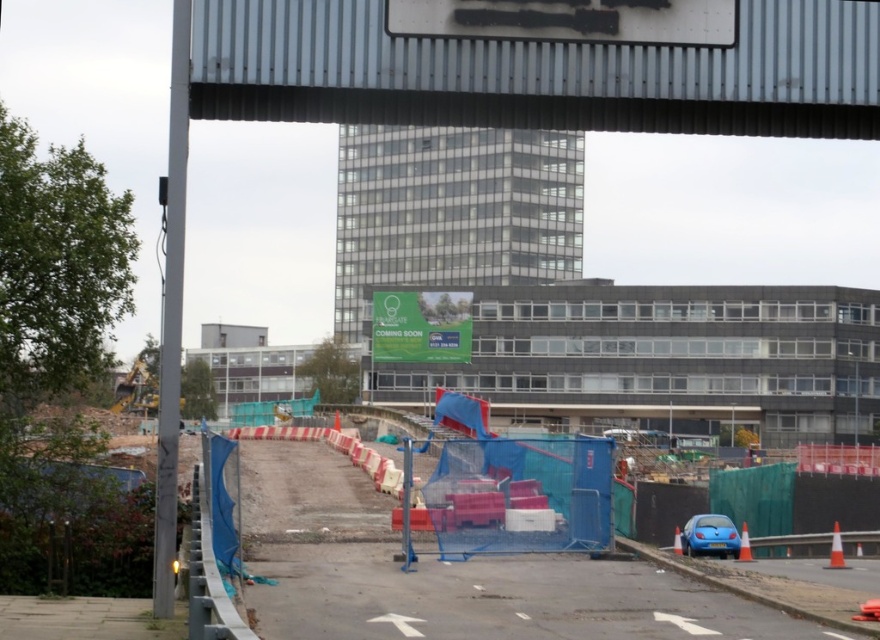
Question: Which of the following is the farthest from the observer?

Choices:
 (A) blue matte car at lower right
 (B) white plastic cone at lower right

Answer: (A)

Question: Is metallic gray overpass at upper center bigger than blue matte car at lower right?

Choices:
 (A) yes
 (B) no

Answer: (B)

Question: Which point is closer to the camera?

Choices:
 (A) (748, 541)
 (B) (396, 348)
 (C) (836, 554)
 (D) (682, 550)

Answer: (C)

Question: Which object appears farthest from the camera in this image?

Choices:
 (A) orange plastic cone at lower right
 (B) blue matte car at lower right
 (C) blue plastic container at center

Answer: (B)

Question: Considering the relative positions of blue matte car at lower right and orange plastic cone at lower right in the image provided, where is blue matte car at lower right located with respect to orange plastic cone at lower right?

Choices:
 (A) left
 (B) right

Answer: (A)

Question: Is green fabric sign at center smaller than orange plastic cone at center?

Choices:
 (A) yes
 (B) no

Answer: (B)